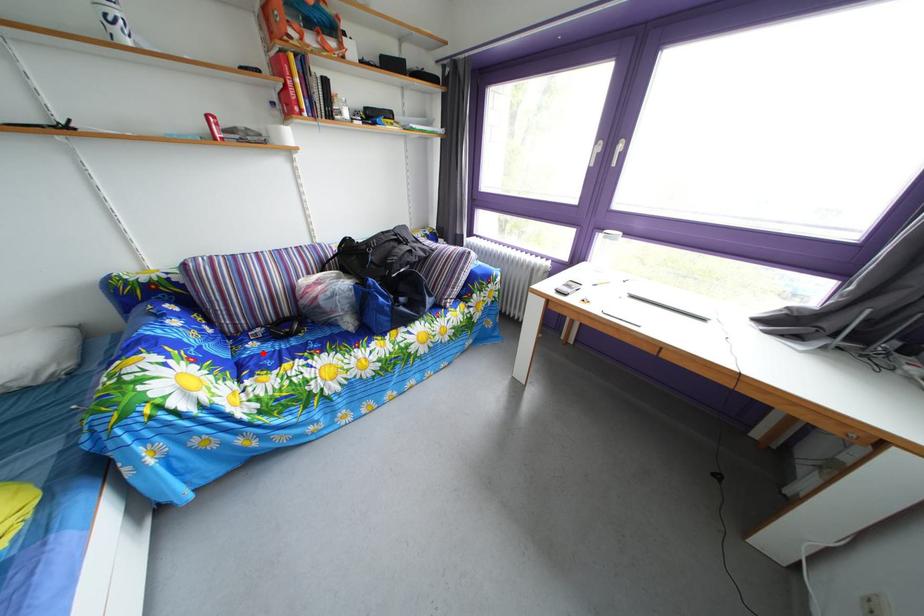
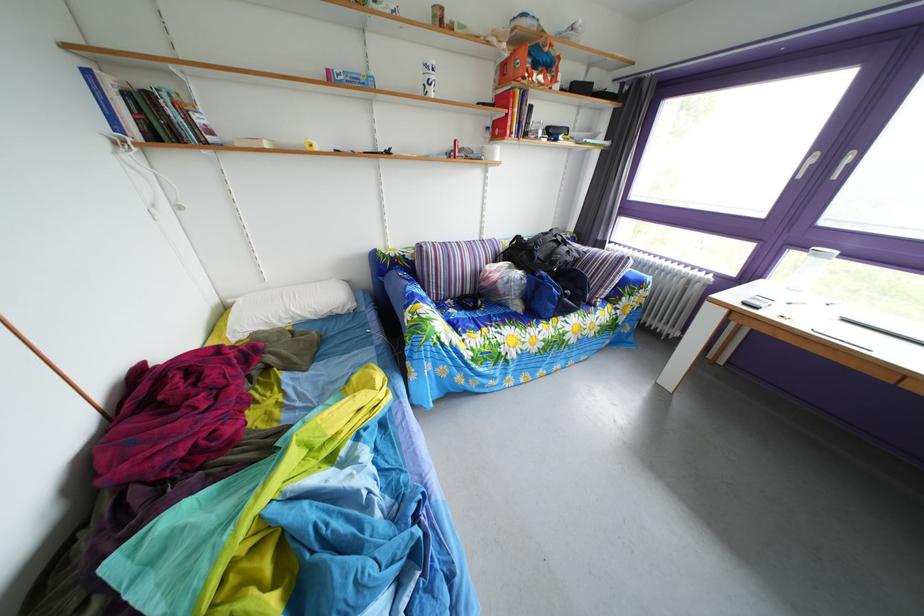
Question: I am providing you with two images of the same scene from different viewpoints. A red point is marked on the first image. Is the red point's position out of view in image 2?

Choices:
 (A) Yes
 (B) No

Answer: (B)